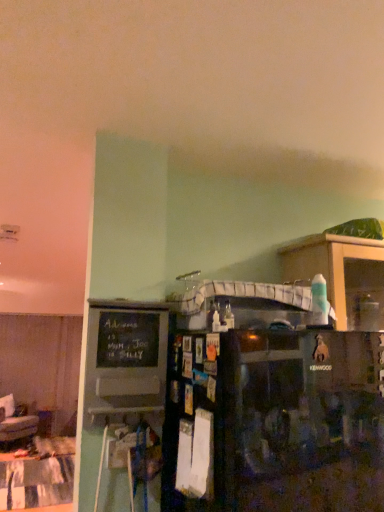
Question: Is black matte refrigerator at center a part of wooden cabinet at right?

Choices:
 (A) no
 (B) yes

Answer: (A)

Question: Considering the relative sizes of wooden cabinet at right and black matte refrigerator at center in the image provided, is wooden cabinet at right smaller than black matte refrigerator at center?

Choices:
 (A) no
 (B) yes

Answer: (B)

Question: Is wooden cabinet at right at the left side of black matte refrigerator at center?

Choices:
 (A) no
 (B) yes

Answer: (A)

Question: Could you tell me if wooden cabinet at right is facing black matte refrigerator at center?

Choices:
 (A) yes
 (B) no

Answer: (B)

Question: Considering the relative sizes of wooden cabinet at right and black matte refrigerator at center in the image provided, is wooden cabinet at right thinner than black matte refrigerator at center?

Choices:
 (A) no
 (B) yes

Answer: (B)

Question: Would you say wooden cabinet at right is a long distance from black matte refrigerator at center?

Choices:
 (A) no
 (B) yes

Answer: (A)

Question: Is wooden cabinet at right shorter than black chalkboard at left?

Choices:
 (A) no
 (B) yes

Answer: (B)

Question: Is black chalkboard at left surrounded by wooden cabinet at right?

Choices:
 (A) yes
 (B) no

Answer: (B)

Question: From the image's perspective, is wooden cabinet at right below black chalkboard at left?

Choices:
 (A) no
 (B) yes

Answer: (A)

Question: Is wooden cabinet at right taller than black chalkboard at left?

Choices:
 (A) no
 (B) yes

Answer: (A)

Question: Can you confirm if wooden cabinet at right is smaller than black chalkboard at left?

Choices:
 (A) no
 (B) yes

Answer: (A)

Question: Can you confirm if wooden cabinet at right is wider than black chalkboard at left?

Choices:
 (A) yes
 (B) no

Answer: (A)

Question: Considering the relative positions of patchwork fabric table at lower left and black matte refrigerator at center in the image provided, is patchwork fabric table at lower left to the left of black matte refrigerator at center from the viewer's perspective?

Choices:
 (A) yes
 (B) no

Answer: (A)